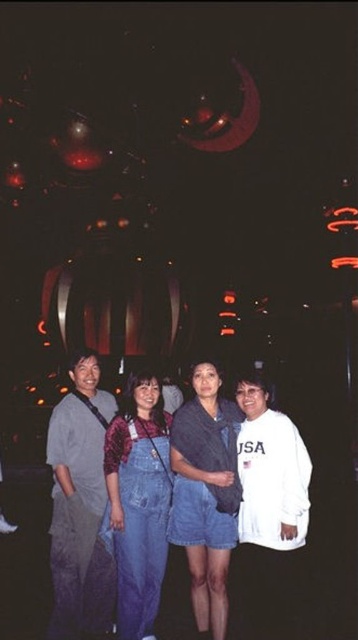
You are a photographer who wants to ensure all subjects are visible in the photo. Given the gray cotton shirt at left and the denim skirt at center, which one is positioned lower in the frame?

The gray cotton shirt at left is below denim skirt at center, so the gray cotton shirt at left is positioned lower in the frame.

You are a photographer standing 2 meters away from the gray cotton shirt at left and denim skirt at center. You want to take a group photo that includes both subjects. Since your camera has a maximum focus range of 1.5 meters, will you be able to capture both subjects clearly in the same frame?

The distance between the gray cotton shirt at left and denim skirt at center is 1.14 meters. Since you are 2 meters away from both subjects, the total distance from you to each subject is within the camera maximum focus range of 1.5 meters. Therefore, you can capture both subjects clearly in the same frame.